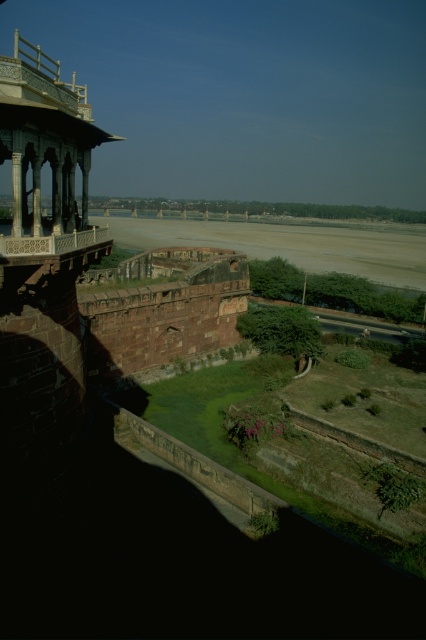
You are standing on the balcony and looking at two points marked on the ground below. The first point is at coordinates point (97, 280) and the second is at point (68, 237). Which point is closer to you?

Point (97, 280) is further to the viewer than point (68, 237), so the second point is closer to you.

You are a tourist standing on the smooth stone balcony at upper left. You want to take a photo of the brown stone wall at center. Which direction should you face to capture it in your shot?

The brown stone wall at center is much taller than the smooth stone balcony at upper left, so you should face downward to capture it in your shot.